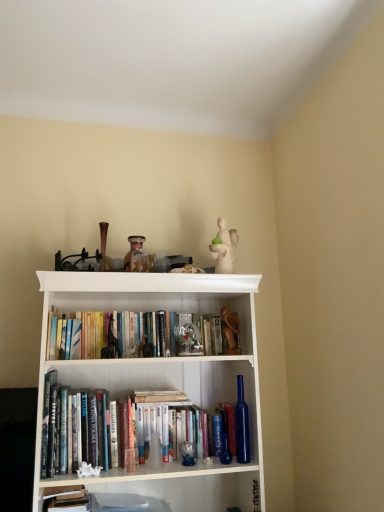
Question: Considering the relative sizes of matte glass jar at upper center, the 1th toy in the left-to-right sequence, and blue glass bottle at lower center in the image provided, is matte glass jar at upper center, the 1th toy in the left-to-right sequence, shorter than blue glass bottle at lower center?

Choices:
 (A) yes
 (B) no

Answer: (A)

Question: Can you confirm if matte glass jar at upper center, which is counted as the 2th toy, starting from the bottom, is wider than blue glass bottle at lower center?

Choices:
 (A) yes
 (B) no

Answer: (A)

Question: From the image's perspective, is matte glass jar at upper center, which is counted as the 2th toy, starting from the bottom, above blue glass bottle at lower center?

Choices:
 (A) yes
 (B) no

Answer: (A)

Question: Is the position of matte glass jar at upper center, which is counted as the 2th toy, starting from the bottom, less distant than that of blue glass bottle at lower center?

Choices:
 (A) yes
 (B) no

Answer: (B)

Question: Is matte glass jar at upper center, the 1th toy in the left-to-right sequence, looking in the opposite direction of blue glass bottle at lower center?

Choices:
 (A) yes
 (B) no

Answer: (B)

Question: From a real-world perspective, is matte glass jar at upper center, which is counted as the 2th toy, starting from the bottom, over blue glass bottle at lower center?

Choices:
 (A) no
 (B) yes

Answer: (B)

Question: Is white porcelain figurine at upper center, which is counted as the second toy, starting from the left, positioned before wooden figurine at center, the 1th toy ordered from the bottom?

Choices:
 (A) yes
 (B) no

Answer: (A)

Question: Is white porcelain figurine at upper center, arranged as the first toy when viewed from the top, at the right side of wooden figurine at center, the 1th toy ordered from the bottom?

Choices:
 (A) no
 (B) yes

Answer: (A)

Question: Considering the relative sizes of white porcelain figurine at upper center, the third toy positioned from the bottom, and wooden figurine at center, arranged as the 1th toy when viewed from the right, in the image provided, is white porcelain figurine at upper center, the third toy positioned from the bottom, taller than wooden figurine at center, arranged as the 1th toy when viewed from the right,?

Choices:
 (A) yes
 (B) no

Answer: (A)

Question: Considering the relative positions of white porcelain figurine at upper center, the third toy positioned from the bottom, and wooden figurine at center, the 1th toy ordered from the bottom, in the image provided, is white porcelain figurine at upper center, the third toy positioned from the bottom, to the left of wooden figurine at center, the 1th toy ordered from the bottom, from the viewer's perspective?

Choices:
 (A) yes
 (B) no

Answer: (A)

Question: Considering the relative positions of white porcelain figurine at upper center, the third toy positioned from the bottom, and wooden figurine at center, the 3th toy in the left-to-right sequence, in the image provided, is white porcelain figurine at upper center, the third toy positioned from the bottom, behind wooden figurine at center, the 3th toy in the left-to-right sequence,?

Choices:
 (A) no
 (B) yes

Answer: (A)

Question: Is white porcelain figurine at upper center, the second toy viewed from the right, in contact with wooden figurine at center, the third toy positioned from the top?

Choices:
 (A) yes
 (B) no

Answer: (B)

Question: Considering the relative positions of white porcelain figurine at upper center, arranged as the first toy when viewed from the top, and hardcover book at lower left, the 1th book when ordered from bottom to top, in the image provided, is white porcelain figurine at upper center, arranged as the first toy when viewed from the top, to the left of hardcover book at lower left, the 1th book when ordered from bottom to top, from the viewer's perspective?

Choices:
 (A) no
 (B) yes

Answer: (A)